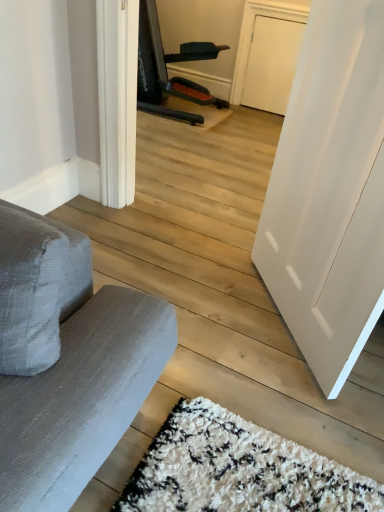
Image resolution: width=384 pixels, height=512 pixels. I want to click on vacant space that is to the left of white smooth door at right, so click(x=198, y=298).